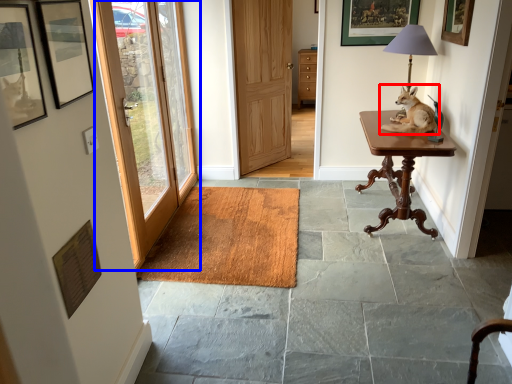
Question: Among these objects, which one is farthest to the camera, dog (highlighted by a red box) or door (highlighted by a blue box)?

Choices:
 (A) dog
 (B) door

Answer: (A)